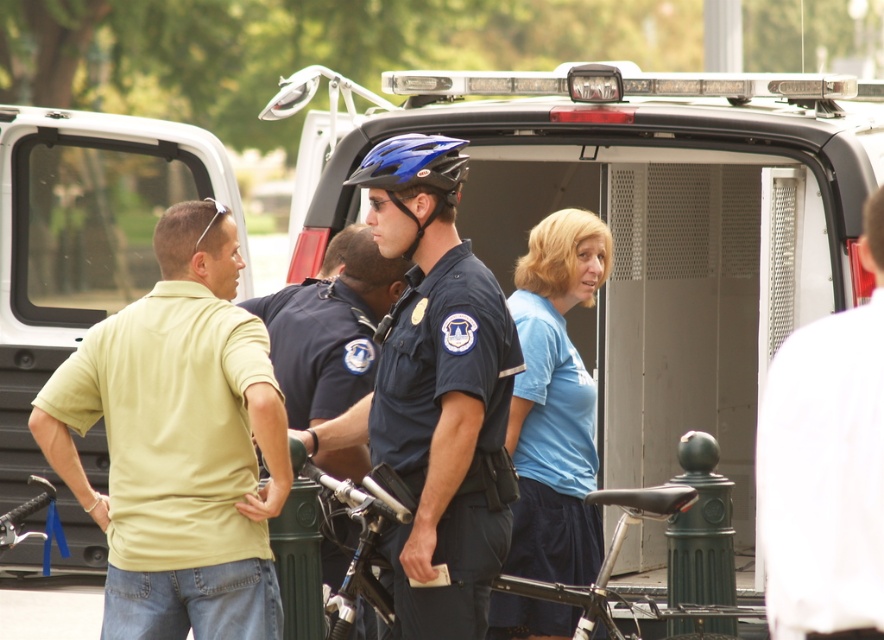
Does light yellow shirt at center appear over blue matte helmet at center?

No.

Is point (387, 284) farther from camera compared to point (387, 172)?

That is True.

Find the location of a particular element. The image size is (884, 640). light yellow shirt at center is located at coordinates (330, 328).

What do you see at coordinates (654, 230) in the screenshot? This screenshot has height=640, width=884. I see `metallic silver van at center` at bounding box center [654, 230].

Is point (352, 198) positioned behind point (382, 160)?

Yes, it is behind point (382, 160).

Locate an element on the screen. The image size is (884, 640). metallic silver van at center is located at coordinates pos(654,230).

Identify the location of metallic silver van at center. (654, 230).

Can you confirm if metallic silver van at center is positioned below dark blue uniform at center?

No, metallic silver van at center is not below dark blue uniform at center.

Is metallic silver van at center closer to camera compared to dark blue uniform at center?

No, metallic silver van at center is behind dark blue uniform at center.

Between point (484, 83) and point (395, 349), which one is positioned in front?

Point (395, 349) is more forward.

Find the location of a particular element. The image size is (884, 640). metallic silver van at center is located at coordinates (654, 230).